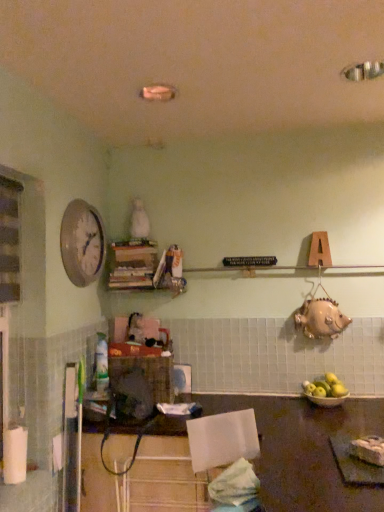
Question: From the image's perspective, is white glossy clock at upper left beneath white matte paper towel at lower left?

Choices:
 (A) yes
 (B) no

Answer: (B)

Question: From the image's perspective, is white glossy clock at upper left above white matte paper towel at lower left?

Choices:
 (A) no
 (B) yes

Answer: (B)

Question: Is white glossy clock at upper left further to camera compared to white matte paper towel at lower left?

Choices:
 (A) no
 (B) yes

Answer: (B)

Question: Can you confirm if white glossy clock at upper left is thinner than white matte paper towel at lower left?

Choices:
 (A) no
 (B) yes

Answer: (B)

Question: Can you confirm if white glossy clock at upper left is positioned to the left of white matte paper towel at lower left?

Choices:
 (A) no
 (B) yes

Answer: (A)

Question: Would you say white matte paper towel at lower left is to the left or to the right of wooden books at center in the picture?

Choices:
 (A) right
 (B) left

Answer: (B)

Question: Is white matte paper towel at lower left taller or shorter than wooden books at center?

Choices:
 (A) short
 (B) tall

Answer: (A)

Question: From a real-world perspective, is white matte paper towel at lower left positioned above or below wooden books at center?

Choices:
 (A) above
 (B) below

Answer: (B)

Question: In terms of width, does white matte paper towel at lower left look wider or thinner when compared to wooden books at center?

Choices:
 (A) thin
 (B) wide

Answer: (A)

Question: Considering the positions of white glossy clock at upper left and yellow matte apple at lower right in the image, is white glossy clock at upper left wider or thinner than yellow matte apple at lower right?

Choices:
 (A) wide
 (B) thin

Answer: (B)

Question: Would you say white glossy clock at upper left is inside or outside yellow matte apple at lower right?

Choices:
 (A) outside
 (B) inside

Answer: (A)

Question: Based on their sizes in the image, would you say white glossy clock at upper left is bigger or smaller than yellow matte apple at lower right?

Choices:
 (A) small
 (B) big

Answer: (B)

Question: In the image, is white glossy clock at upper left positioned in front of or behind yellow matte apple at lower right?

Choices:
 (A) behind
 (B) front

Answer: (B)

Question: Considering the positions of point (178, 258) and point (311, 384), is point (178, 258) closer or farther from the camera than point (311, 384)?

Choices:
 (A) farther
 (B) closer

Answer: (A)

Question: Visually, is wooden books at center positioned to the left or to the right of yellow matte apple at lower right?

Choices:
 (A) left
 (B) right

Answer: (A)